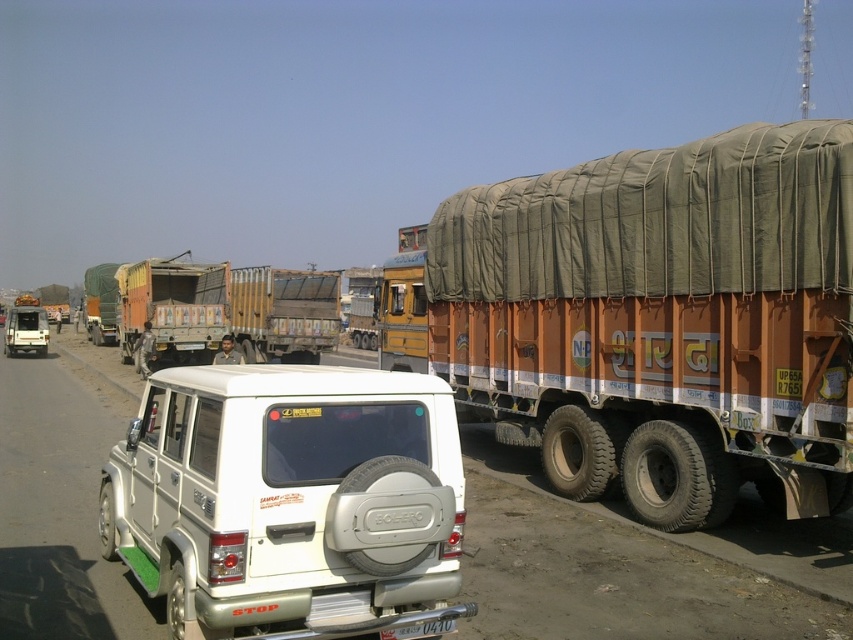
You are a driver who wants to park your car behind the brown canvas trailer truck at right and the white plastic license plate at center. Which object should you avoid when backing up?

You should avoid the brown canvas trailer truck at right because it is larger in size compared to the white plastic license plate at center, making it more likely to cause damage if collided with.

You are a delivery driver who needs to park your vehicle near the white Mahindra Bolero SUV. The parking spot is marked by the point at coordinates (660, 317). Can you safely park your vehicle there without blocking the brown canvas trailer truck at right?

The point at coordinates (660, 317) marks the brown canvas trailer truck at right, so parking there would block it. Choose another spot.